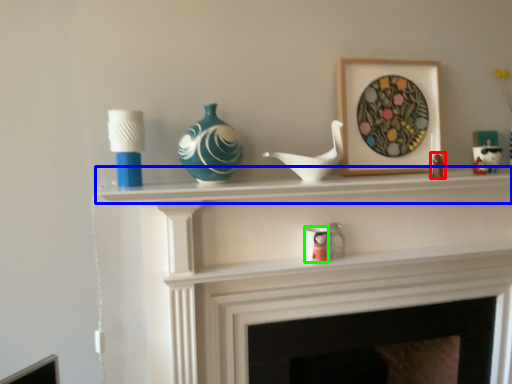
Question: Which object is positioned closest to toy (highlighted by a red box)? Select from mantle (highlighted by a blue box) and candle holder (highlighted by a green box).

Choices:
 (A) mantle
 (B) candle holder

Answer: (A)